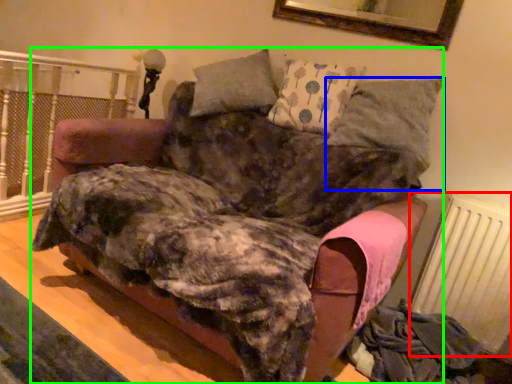
Question: Estimate the real-world distances between objects in this image. Which object is farther from radiator (highlighted by a red box), pillow (highlighted by a blue box) or furniture (highlighted by a green box)?

Choices:
 (A) pillow
 (B) furniture

Answer: (B)